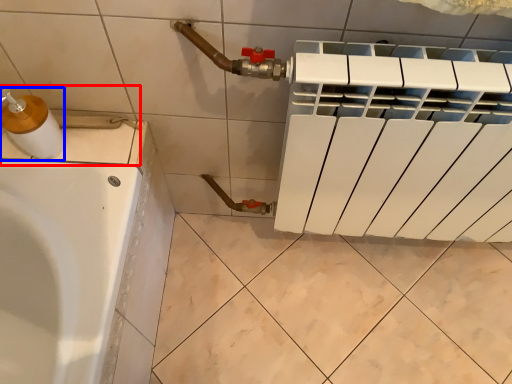
Question: Which point is closer to the camera, sink (highlighted by a red box) or soap dispenser (highlighted by a blue box)?

Choices:
 (A) sink
 (B) soap dispenser

Answer: (B)